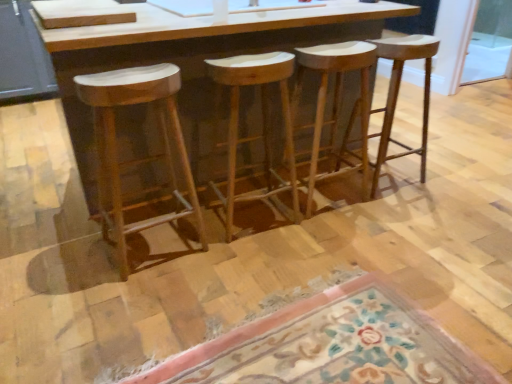
Locate an element on the screen. This screenshot has height=384, width=512. vacant area located to the right-hand side of natural wood stool at left, arranged as the first stool when viewed from the left is located at coordinates (226, 261).